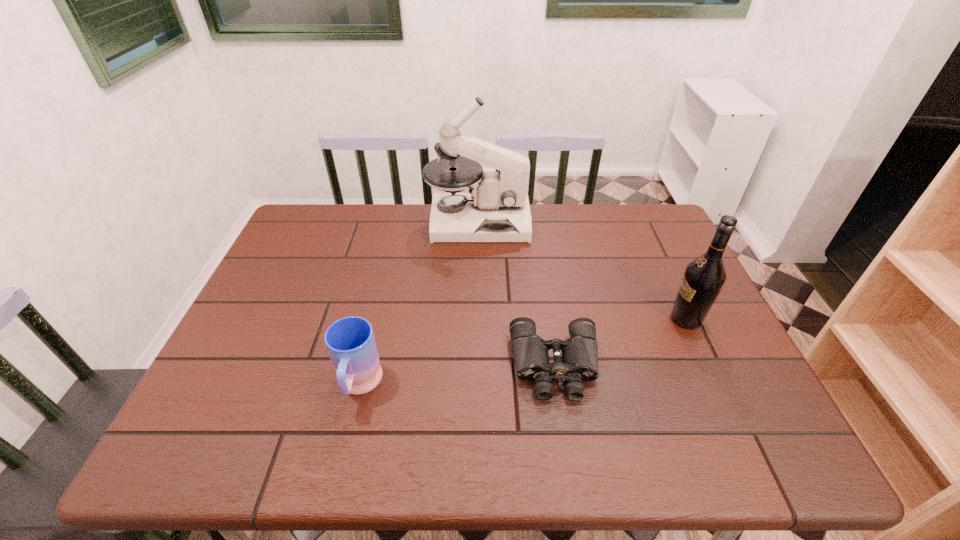
The height and width of the screenshot is (540, 960). Find the location of `object that stands as the closest to the second farthest object`. object that stands as the closest to the second farthest object is located at coordinates (580, 352).

Identify which object is the third closest to the rightmost object. Please provide its 2D coordinates. Your answer should be formatted as a tuple, i.e. [(x, y)], where the tuple contains the x and y coordinates of a point satisfying the conditions above.

[(350, 341)]

Image resolution: width=960 pixels, height=540 pixels. I want to click on free spot that satisfies the following two spatial constraints: 1. on the label of the wine bottle; 2. on the side of the mug with the handle, so click(717, 386).

Image resolution: width=960 pixels, height=540 pixels. Find the location of `blank space that satisfies the following two spatial constraints: 1. on the label of the second farthest object; 2. on the side of the leftmost object with the handle`. blank space that satisfies the following two spatial constraints: 1. on the label of the second farthest object; 2. on the side of the leftmost object with the handle is located at coordinates (717, 386).

At what (x,y) coordinates should I click in order to perform the action: click on free spot that satisfies the following two spatial constraints: 1. at the eyepiece of the farthest object; 2. on the side of the leftmost object with the handle. Please return your answer as a coordinate pair (x, y). Image resolution: width=960 pixels, height=540 pixels. Looking at the image, I should click on (476, 386).

Locate an element on the screen. Image resolution: width=960 pixels, height=540 pixels. free space in the image that satisfies the following two spatial constraints: 1. at the eyepiece of the tallest object; 2. on the side of the second shortest object with the handle is located at coordinates (476, 386).

Where is `vacant position in the image that satisfies the following two spatial constraints: 1. on the label of the wine bottle; 2. on the side of the mug with the handle`? This screenshot has height=540, width=960. vacant position in the image that satisfies the following two spatial constraints: 1. on the label of the wine bottle; 2. on the side of the mug with the handle is located at coordinates (717, 386).

Where is `vacant position in the image that satisfies the following two spatial constraints: 1. on the label of the third nearest object; 2. on the side of the leftmost object with the handle`? Image resolution: width=960 pixels, height=540 pixels. vacant position in the image that satisfies the following two spatial constraints: 1. on the label of the third nearest object; 2. on the side of the leftmost object with the handle is located at coordinates (717, 386).

Where is `vacant space that satisfies the following two spatial constraints: 1. on the label of the third nearest object; 2. through the eyepieces of the shortest object`? vacant space that satisfies the following two spatial constraints: 1. on the label of the third nearest object; 2. through the eyepieces of the shortest object is located at coordinates (708, 366).

At what (x,y) coordinates should I click in order to perform the action: click on vacant space that satisfies the following two spatial constraints: 1. at the eyepiece of the tallest object; 2. on the side of the third tallest object with the handle. Please return your answer as a coordinate pair (x, y). This screenshot has width=960, height=540. Looking at the image, I should click on (476, 386).